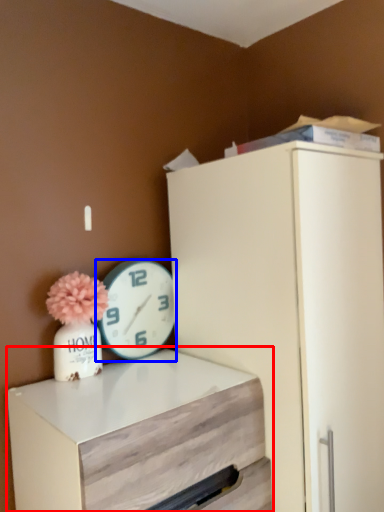
Question: Which object appears closest to the camera in this image, chest of drawers (highlighted by a red box) or wall clock (highlighted by a blue box)?

Choices:
 (A) chest of drawers
 (B) wall clock

Answer: (A)